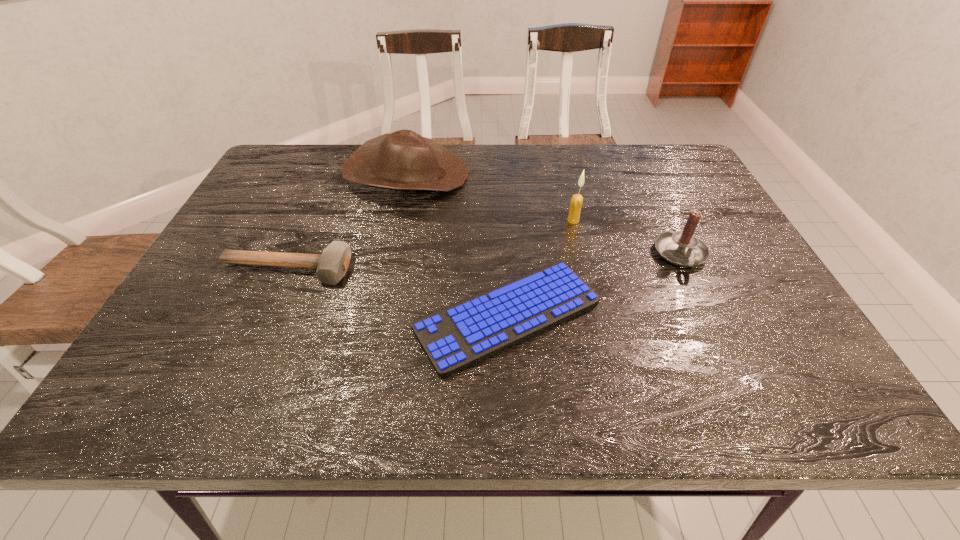
Find the location of a particular element. The width and height of the screenshot is (960, 540). the taller candle is located at coordinates (576, 201).

The height and width of the screenshot is (540, 960). Find the location of `the farther candle`. the farther candle is located at coordinates (576, 201).

Where is `cowboy hat`? cowboy hat is located at coordinates (403, 160).

Locate an element on the screen. This screenshot has width=960, height=540. the right candle is located at coordinates (682, 248).

Locate an element on the screen. This screenshot has width=960, height=540. the rightmost object is located at coordinates (682, 248).

Where is `mallet`? mallet is located at coordinates (332, 264).

This screenshot has height=540, width=960. Find the location of `the shortest object`. the shortest object is located at coordinates (460, 335).

You are a GUI agent. You are given a task and a screenshot of the screen. Output one action in this format:
    pyautogui.click(x=<x>, y=<y>)
    Task: Click on the free region located on the back of the left candle
    The width and height of the screenshot is (960, 540).
    Given the screenshot: What is the action you would take?
    pyautogui.click(x=562, y=172)

The image size is (960, 540). In order to click on vacant space located 0.090m on the left of the farthest object in this screenshot , I will do `click(314, 176)`.

Find the location of a particular element. The image size is (960, 540). free spot located on the side of the right candle with the handle loop is located at coordinates (700, 295).